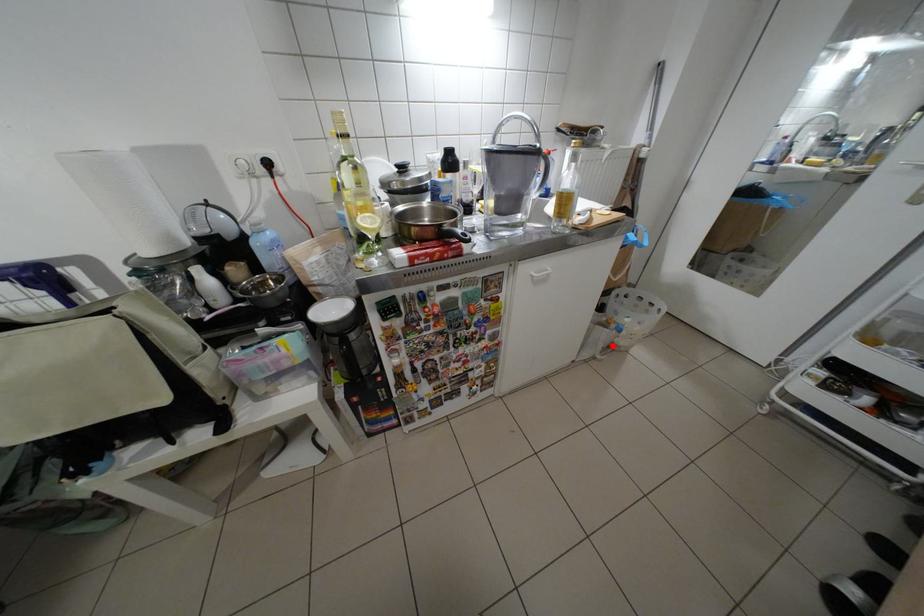
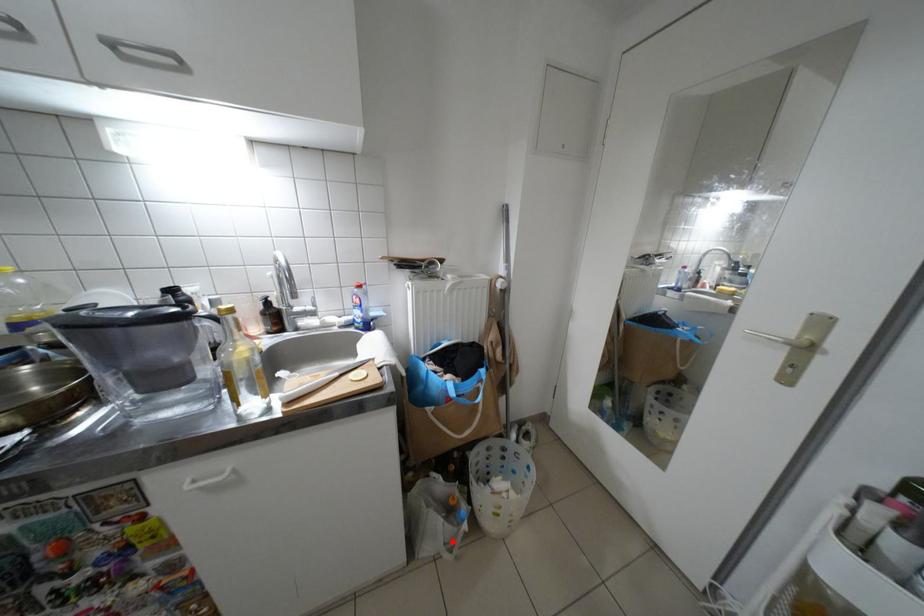
I am providing you with two images of the same scene from different viewpoints. A red point is marked on the first image and another point is marked on the second image. Do the highlighted points in image1 and image2 indicate the same real-world spot?

Yes